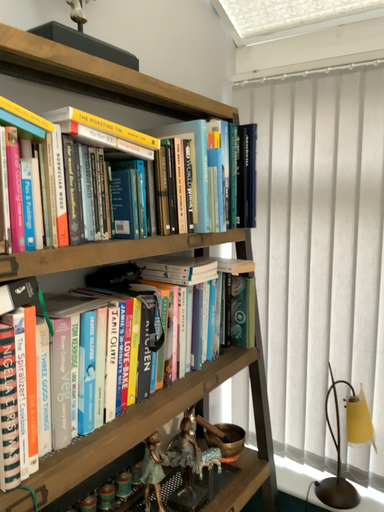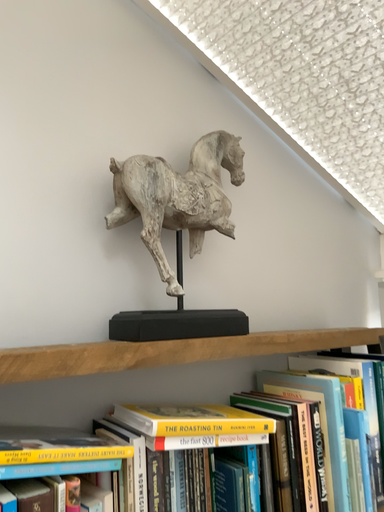
Question: How did the camera likely rotate when shooting the video?

Choices:
 (A) rotated upward
 (B) rotated downward

Answer: (A)